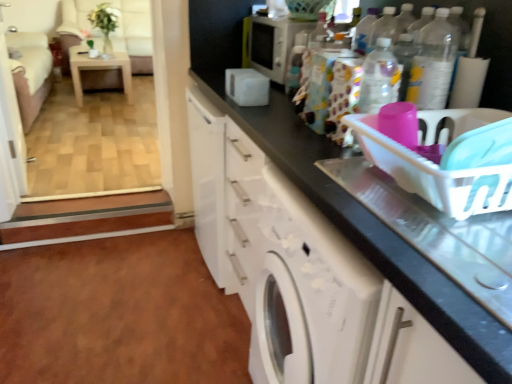
The height and width of the screenshot is (384, 512). What do you see at coordinates (30, 72) in the screenshot?
I see `velvet pink couch at left` at bounding box center [30, 72].

In order to face white glossy washing machine at center, should I rotate leftwards or rightwards?

To face it directly, rotate right by 2.735 degrees.

What do you see at coordinates (10, 141) in the screenshot?
I see `white glossy screen door at upper left` at bounding box center [10, 141].

Find the location of `patterned fabric bag at upper center, acting as the 2th bottle starting from the right`. patterned fabric bag at upper center, acting as the 2th bottle starting from the right is located at coordinates (314, 46).

From the image's perspective, would you say white glossy microwave at upper center is shown under white glossy screen door at upper left?

No, from the image's perspective, white glossy microwave at upper center is not below white glossy screen door at upper left.

Is white glossy microwave at upper center to the left of white glossy screen door at upper left from the viewer's perspective?

No.

Can you tell me how much white glossy microwave at upper center and white glossy screen door at upper left differ in facing direction?

The angle between the facing direction of white glossy microwave at upper center and the facing direction of white glossy screen door at upper left is 174 degrees.

Is point (292, 25) behind point (0, 201)?

No, (292, 25) is closer to viewer.

Is beige fabric armchair at upper left to the right of white plastic basket at right from the viewer's perspective?

Incorrect, beige fabric armchair at upper left is not on the right side of white plastic basket at right.

Does point (146, 70) appear closer or farther from the camera than point (476, 197)?

Point (146, 70) appears to be farther away from the viewer than point (476, 197).

Are beige fabric armchair at upper left and white plastic basket at right located far from each other?

That's right, there is a large distance between beige fabric armchair at upper left and white plastic basket at right.

Is white plastic basket at right inside beige fabric armchair at upper left?

No, beige fabric armchair at upper left does not contain white plastic basket at right.

How different are the orientations of white glossy cabinet at lower center and clear plastic bottle at upper right, placed as the first bottle when sorted from right to left, in degrees?

0.121 degrees.

Does point (270, 115) lie behind point (416, 90)?

Yes, point (270, 115) is farther from viewer.

Visually, is white glossy cabinet at lower center positioned to the left or to the right of clear plastic bottle at upper right, which is the 1th bottle in front-to-back order?

Based on their positions, white glossy cabinet at lower center is located to the left of clear plastic bottle at upper right, which is the 1th bottle in front-to-back order.

From the image's perspective, which is above, white glossy cabinet at lower center or clear plastic bottle at upper right, marked as the second bottle in a back-to-front arrangement?

clear plastic bottle at upper right, marked as the second bottle in a back-to-front arrangement, from the image's perspective.

Can you confirm if white glossy washing machine at center is positioned to the right of white plastic basket at right?

No.

From the image's perspective, who appears lower, white glossy washing machine at center or white plastic basket at right?

white glossy washing machine at center appears lower in the image.

Identify the location of washing machine below the white plastic basket at right (from the image's perspective). (308, 294).

Considering the positions of objects white plastic basket at right and beige fabric armchair at upper left in the image provided, who is behind, white plastic basket at right or beige fabric armchair at upper left?

beige fabric armchair at upper left is more distant.

Considering the points (445, 209) and (79, 11), which point is behind, point (445, 209) or point (79, 11)?

The point (79, 11) is farther from the camera.

Is white plastic basket at right bigger or smaller than beige fabric armchair at upper left?

Clearly, white plastic basket at right is smaller in size than beige fabric armchair at upper left.

From the image's perspective, is white plastic basket at right beneath beige fabric armchair at upper left?

Indeed, from the image's perspective, white plastic basket at right is shown beneath beige fabric armchair at upper left.

In the scene shown: Considering the relative positions of patterned fabric bag at upper center, acting as the first bottle starting from the left, and white glossy microwave at upper center in the image provided, is patterned fabric bag at upper center, acting as the first bottle starting from the left, to the right of white glossy microwave at upper center from the viewer's perspective?

Indeed, patterned fabric bag at upper center, acting as the first bottle starting from the left, is positioned on the right side of white glossy microwave at upper center.

Is patterned fabric bag at upper center, which is the 2th bottle in front-to-back order, thinner than white glossy microwave at upper center?

Correct, the width of patterned fabric bag at upper center, which is the 2th bottle in front-to-back order, is less than that of white glossy microwave at upper center.

From the image's perspective, is patterned fabric bag at upper center, acting as the first bottle starting from the left, beneath white glossy microwave at upper center?

Correct, patterned fabric bag at upper center, acting as the first bottle starting from the left, appears lower than white glossy microwave at upper center in the image.

Is patterned fabric bag at upper center, marked as the first bottle in a back-to-front arrangement, facing away from white glossy microwave at upper center?

No, patterned fabric bag at upper center, marked as the first bottle in a back-to-front arrangement,'s orientation is not away from white glossy microwave at upper center.

Which object is positioned more to the right, patterned fabric bag at upper center, acting as the first bottle starting from the left, or clear plastic bottle at upper right, marked as the 2th bottle in a left-to-right arrangement?

clear plastic bottle at upper right, marked as the 2th bottle in a left-to-right arrangement, is more to the right.

Is patterned fabric bag at upper center, acting as the 2th bottle starting from the right, behind clear plastic bottle at upper right, marked as the second bottle in a back-to-front arrangement?

Yes, patterned fabric bag at upper center, acting as the 2th bottle starting from the right, is further from the camera.

In the scene shown: From their relative heights in the image, would you say patterned fabric bag at upper center, acting as the 2th bottle starting from the right, is taller or shorter than clear plastic bottle at upper right, marked as the 2th bottle in a left-to-right arrangement?

patterned fabric bag at upper center, acting as the 2th bottle starting from the right, is shorter than clear plastic bottle at upper right, marked as the 2th bottle in a left-to-right arrangement.

Locate an element on the screen. screen door below the white glossy microwave at upper center (from the image's perspective) is located at coordinates (10, 141).

At what (x,y) coordinates should I click in order to perform the action: click on armchair that appears below the white plastic basket at right (from a real-world perspective). Please return your answer as a coordinate pair (x, y). The image size is (512, 384). Looking at the image, I should click on (113, 32).

From the image, which object appears to be nearer to white glossy microwave at upper center, patterned fabric bag at upper center, acting as the 2th bottle starting from the right, or white glossy cabinet at lower center?

Based on the image, patterned fabric bag at upper center, acting as the 2th bottle starting from the right, appears to be nearer to white glossy microwave at upper center.

Looking at the image, which one is located closer to white glossy cabinet at lower center, white glossy screen door at upper left or white glossy washing machine at center?

white glossy washing machine at center lies closer to white glossy cabinet at lower center than the other object.

When comparing their distances from white plastic basket at right, does clear plastic bottle at upper right, which is the 1th bottle in front-to-back order, or velvet pink couch at left seem closer?

clear plastic bottle at upper right, which is the 1th bottle in front-to-back order, is positioned closer to the anchor white plastic basket at right.

Considering their positions, is white glossy washing machine at center positioned further to white glossy table at upper left than white glossy microwave at upper center?

Among the two, white glossy washing machine at center is located further to white glossy table at upper left.

Looking at the image, which one is located closer to clear plastic bottle at upper right, which is the 1th bottle in front-to-back order, white glossy microwave at upper center or white glossy table at upper left?

The object closer to clear plastic bottle at upper right, which is the 1th bottle in front-to-back order, is white glossy microwave at upper center.

Estimate the real-world distances between objects in this image. Which object is further from beige fabric armchair at upper left, white glossy washing machine at center or clear plastic bottle at upper right, which is the 1th bottle in front-to-back order?

clear plastic bottle at upper right, which is the 1th bottle in front-to-back order, lies further to beige fabric armchair at upper left than the other object.

Estimate the real-world distances between objects in this image. Which object is further from patterned fabric bag at upper center, acting as the 2th bottle starting from the right, beige fabric armchair at upper left or velvet pink couch at left?

beige fabric armchair at upper left is further to patterned fabric bag at upper center, acting as the 2th bottle starting from the right.

From the image, which object appears to be nearer to clear plastic bottle at upper right, marked as the second bottle in a back-to-front arrangement, white glossy microwave at upper center or velvet pink couch at left?

white glossy microwave at upper center is positioned closer to the anchor clear plastic bottle at upper right, marked as the second bottle in a back-to-front arrangement.

You are a GUI agent. You are given a task and a screenshot of the screen. Output one action in this format:
    pyautogui.click(x=<x>, y=<y>)
    Task: Click on the bottle between white glossy screen door at upper left and white glossy cabinet at lower center in the horizontal direction
    The image size is (512, 384).
    Given the screenshot: What is the action you would take?
    pyautogui.click(x=314, y=46)

Where is `table between patterned fabric bag at upper center, which is the 2th bottle in front-to-back order, and beige fabric armchair at upper left, along the z-axis`? The height and width of the screenshot is (384, 512). table between patterned fabric bag at upper center, which is the 2th bottle in front-to-back order, and beige fabric armchair at upper left, along the z-axis is located at coordinates 99,69.

At what (x,y) coordinates should I click in order to perform the action: click on washing machine between clear plastic bottle at upper right, marked as the 2th bottle in a left-to-right arrangement, and beige fabric armchair at upper left, along the z-axis. Please return your answer as a coordinate pair (x, y). Looking at the image, I should click on (308, 294).

You are a GUI agent. You are given a task and a screenshot of the screen. Output one action in this format:
    pyautogui.click(x=<x>, y=<y>)
    Task: Click on the bottle positioned between clear plastic bottle at upper right, marked as the second bottle in a back-to-front arrangement, and white glossy table at upper left from near to far
    Image resolution: width=512 pixels, height=384 pixels.
    Given the screenshot: What is the action you would take?
    pyautogui.click(x=314, y=46)